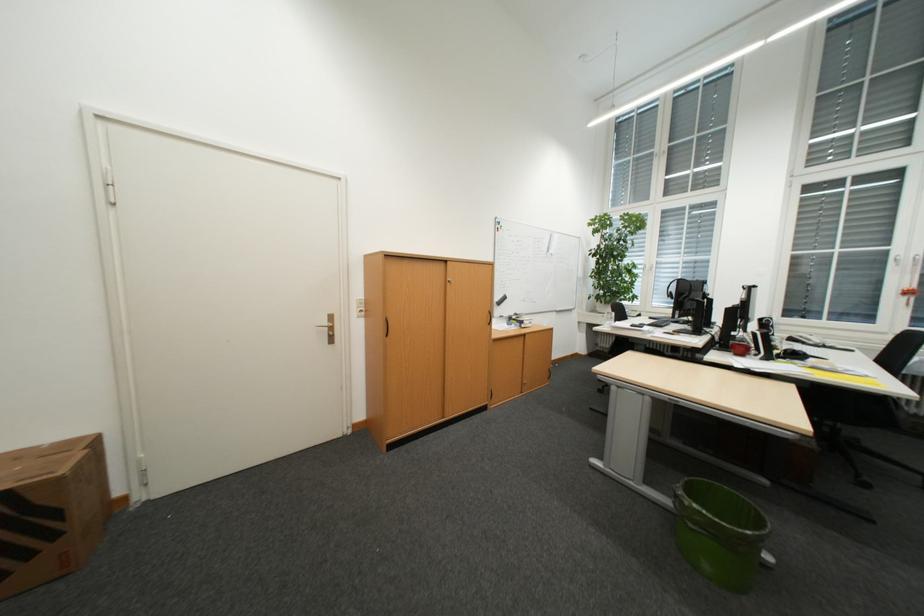
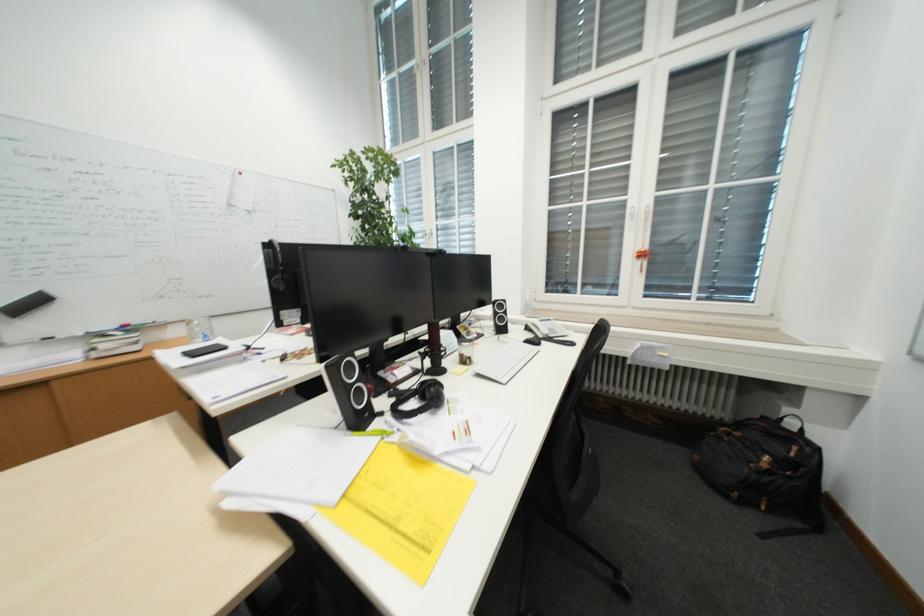
What movement of the cameraman would produce the second image?

The movement direction of the cameraman is right, forward.